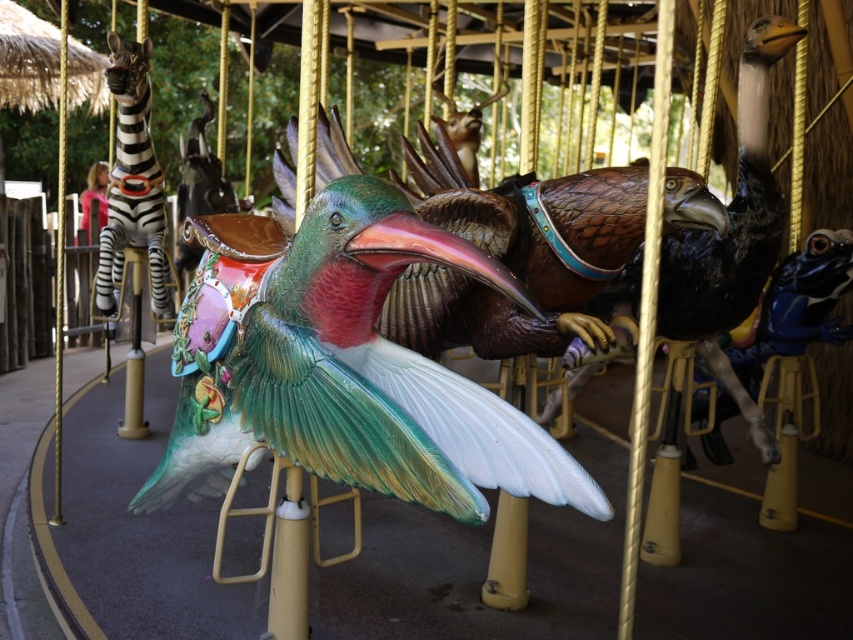
Is shiny brown feathers at center further to the viewer compared to shiny metallic zebra at left?

No, shiny brown feathers at center is in front of shiny metallic zebra at left.

Does shiny brown feathers at center appear on the left side of shiny metallic zebra at left?

No, shiny brown feathers at center is not to the left of shiny metallic zebra at left.

Between point (756, 157) and point (103, 244), which one is positioned in front?

Point (756, 157) is in front.

Locate an element on the screen. This screenshot has height=640, width=853. shiny brown feathers at center is located at coordinates (732, 236).

Does shiny green and white bird at center come in front of shiny metallic zebra at left?

Yes, shiny green and white bird at center is closer to the viewer.

Does shiny green and white bird at center have a larger size compared to shiny metallic zebra at left?

Actually, shiny green and white bird at center might be smaller than shiny metallic zebra at left.

Measure the distance between shiny green and white bird at center and camera.

shiny green and white bird at center and camera are 1.36 meters apart from each other.

Find the location of a particular element. shiny green and white bird at center is located at coordinates (347, 372).

Who is taller, shiny green and white bird at center or shiny brown feathers at center?

shiny brown feathers at center is taller.

Does shiny green and white bird at center have a greater width compared to shiny brown feathers at center?

Yes, shiny green and white bird at center is wider than shiny brown feathers at center.

Does point (294, 269) come behind point (714, 294)?

No, (294, 269) is closer to viewer.

This screenshot has width=853, height=640. I want to click on shiny green and white bird at center, so click(347, 372).